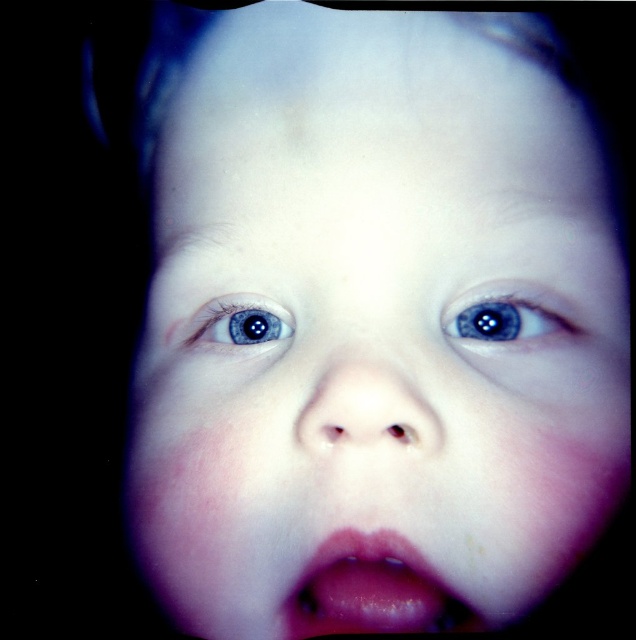
Question: Does pink glossy lips at center have a lesser width compared to blue glossy eye at upper left?

Choices:
 (A) no
 (B) yes

Answer: (A)

Question: Which of the following is the farthest from the observer?

Choices:
 (A) blue glossy eye at center
 (B) blue glossy eye at upper left
 (C) pink glossy lips at center

Answer: (B)

Question: Among these objects, which one is farthest from the camera?

Choices:
 (A) blue glossy eye at upper left
 (B) pink glossy lips at center
 (C) blue glossy eye at center

Answer: (A)

Question: Is pink glossy lips at center wider than blue glossy eye at upper left?

Choices:
 (A) no
 (B) yes

Answer: (B)

Question: Which object appears closest to the camera in this image?

Choices:
 (A) pink glossy lips at center
 (B) blue glossy eye at center

Answer: (A)

Question: Is pink glossy lips at center to the right of blue glossy eye at center from the viewer's perspective?

Choices:
 (A) no
 (B) yes

Answer: (A)